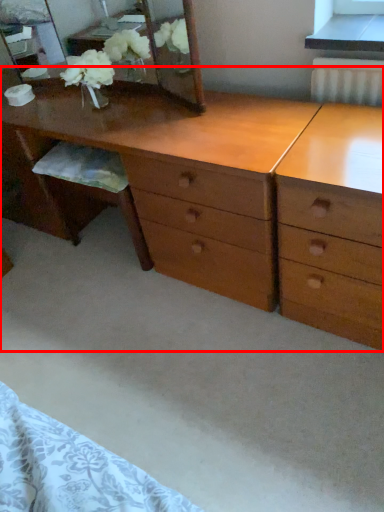
Question: From the image's perspective, where is desk (annotated by the red box) located in relation to mirror in the image?

Choices:
 (A) above
 (B) below

Answer: (B)